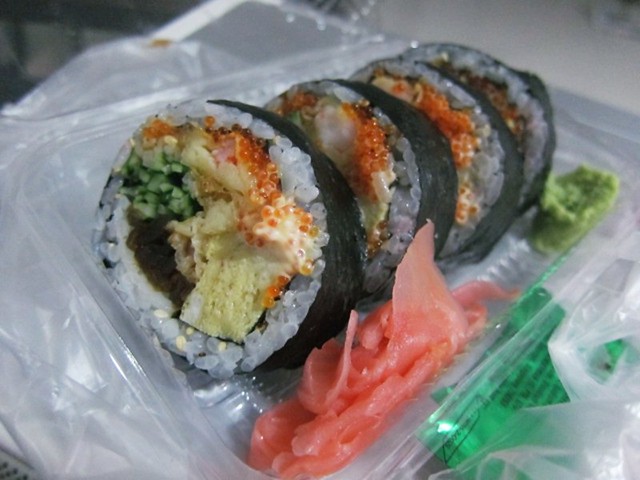
At what (x,y) coordinates should I click in order to perform the action: click on plastic container. Please return your answer as a coordinate pair (x, y). This screenshot has width=640, height=480. Looking at the image, I should click on (168, 408).